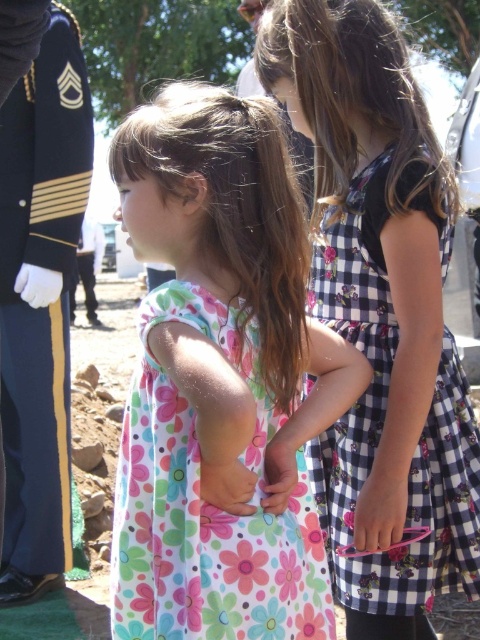
Does pink fabric hand at center appear on the left side of floral fabric hand at center?

Incorrect, pink fabric hand at center is not on the left side of floral fabric hand at center.

What do you see at coordinates (382, 506) in the screenshot? I see `pink fabric hand at center` at bounding box center [382, 506].

Between point (373, 508) and point (240, 509), which one is positioned in front?

Point (240, 509) is more forward.

You are a GUI agent. You are given a task and a screenshot of the screen. Output one action in this format:
    pyautogui.click(x=<x>, y=<y>)
    Task: Click on the pink fabric hand at center
    
    Given the screenshot: What is the action you would take?
    coord(382,506)

Is dark blue wool uniform at left bigger than matte floral dress at center?

Indeed, dark blue wool uniform at left has a larger size compared to matte floral dress at center.

Is point (27, 278) positioned behind point (276, 472)?

Yes.

Which is in front, point (67, 561) or point (287, 497)?

Point (287, 497) is more forward.

Locate an element on the screen. dark blue wool uniform at left is located at coordinates (40, 288).

In the scene shown: Does checkered fabric dress at center appear on the right side of matte floral dress at center?

Yes, checkered fabric dress at center is to the right of matte floral dress at center.

Does point (317, 243) come behind point (295, 477)?

Yes, it is behind point (295, 477).

Does point (358, 492) come farther from viewer compared to point (276, 490)?

Yes, it is behind point (276, 490).

Identify the location of checkered fabric dress at center. (384, 422).